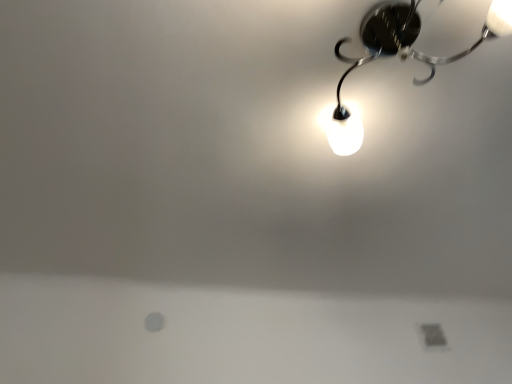
Locate an element on the screen. Image resolution: width=512 pixels, height=384 pixels. matte white lamp at upper right is located at coordinates (399, 55).

Image resolution: width=512 pixels, height=384 pixels. What do you see at coordinates (399, 55) in the screenshot?
I see `matte white lamp at upper right` at bounding box center [399, 55].

Where is `matte white lamp at upper right`? This screenshot has height=384, width=512. matte white lamp at upper right is located at coordinates [x=399, y=55].